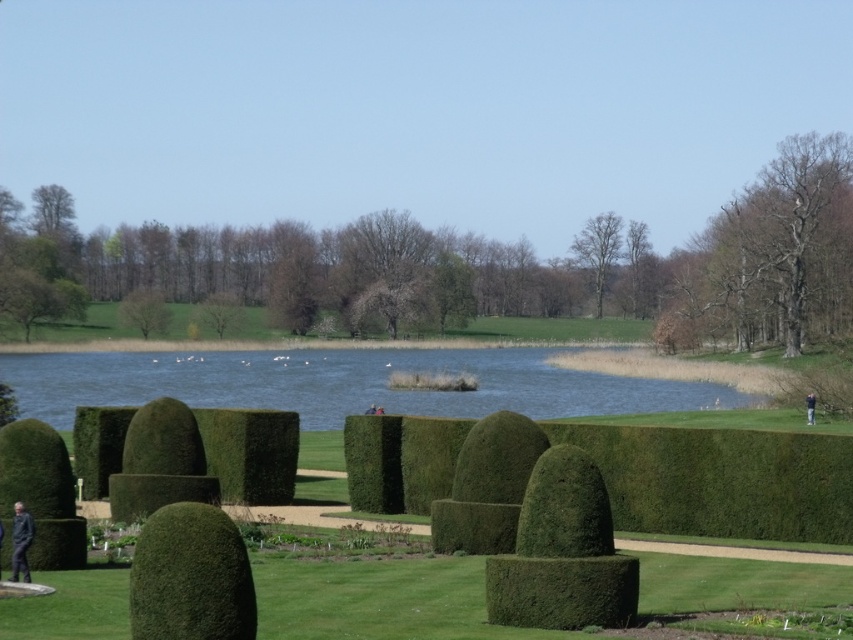
Which is below, bare wood tree at upper right or green leafy hedge at lower left?

Positioned lower is green leafy hedge at lower left.

Which is more to the right, bare wood tree at upper right or green leafy hedge at lower left?

bare wood tree at upper right

What are the coordinates of `bare wood tree at upper right` in the screenshot? It's located at (776, 250).

You are a GUI agent. You are given a task and a screenshot of the screen. Output one action in this format:
    pyautogui.click(x=<x>, y=<y>)
    Task: Click on the bare wood tree at upper right
    
    Given the screenshot: What is the action you would take?
    pyautogui.click(x=776, y=250)

Who is positioned more to the right, green leafy hedge at center or bare wood tree at upper right?

bare wood tree at upper right is more to the right.

Who is more forward, (556, 442) or (837, 237)?

Positioned in front is point (556, 442).

Is point (639, 513) farther from camera compared to point (740, 280)?

No, (639, 513) is closer to viewer.

Identify the location of green leafy hedge at center. (721, 480).

Can you confirm if green leafy hedge at center is positioned to the left of green leafy hedge at lower left?

Incorrect, green leafy hedge at center is not on the left side of green leafy hedge at lower left.

Is green leafy hedge at center bigger than green leafy hedge at lower left?

Yes, green leafy hedge at center is bigger than green leafy hedge at lower left.

This screenshot has width=853, height=640. What are the coordinates of `green leafy hedge at center` in the screenshot? It's located at (721, 480).